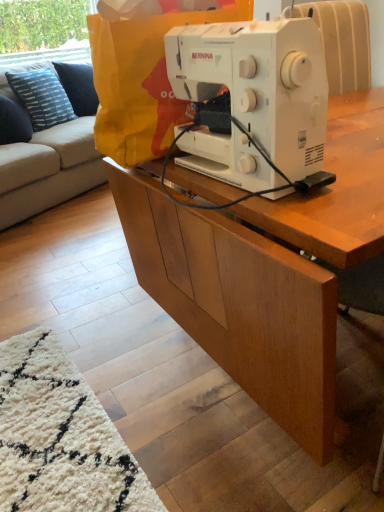
Where is `yellow paper bag at center`? The image size is (384, 512). yellow paper bag at center is located at coordinates (142, 80).

The height and width of the screenshot is (512, 384). Describe the element at coordinates (253, 103) in the screenshot. I see `white plastic sewing machine at center` at that location.

This screenshot has width=384, height=512. I want to click on light gray fabric couch at upper left, so click(x=47, y=143).

The width and height of the screenshot is (384, 512). In order to click on sewing machine that is in front of the yellow paper bag at center in this screenshot , I will do [x=253, y=103].

Considering the sizes of objects white plastic sewing machine at center and yellow paper bag at center in the image provided, who is taller, white plastic sewing machine at center or yellow paper bag at center?

With more height is yellow paper bag at center.

Does white plastic sewing machine at center have a greater width compared to yellow paper bag at center?

Incorrect, the width of white plastic sewing machine at center does not surpass that of yellow paper bag at center.

Does point (260, 189) come closer to viewer compared to point (231, 4)?

Yes, it is in front of point (231, 4).

Which object is wider, blue striped fabric pillow at upper left or wooden cabinet at center?

wooden cabinet at center is wider.

Can you confirm if blue striped fabric pillow at upper left is positioned to the right of wooden cabinet at center?

Incorrect, blue striped fabric pillow at upper left is not on the right side of wooden cabinet at center.

From a real-world perspective, is blue striped fabric pillow at upper left positioned under wooden cabinet at center based on gravity?

No, from a real-world perspective, blue striped fabric pillow at upper left is not under wooden cabinet at center.

Between blue striped fabric pillow at upper left and wooden cabinet at center, which one is positioned in front?

wooden cabinet at center is in front.

Consider the image. Who is more distant, blue striped fabric pillow at upper left or white plastic sewing machine at center?

blue striped fabric pillow at upper left is further away from the camera.

Could you measure the distance between blue striped fabric pillow at upper left and white plastic sewing machine at center?

blue striped fabric pillow at upper left and white plastic sewing machine at center are 2.43 meters apart.

Is blue striped fabric pillow at upper left bigger or smaller than white plastic sewing machine at center?

Clearly, blue striped fabric pillow at upper left is larger in size than white plastic sewing machine at center.

From a real-world perspective, who is located lower, blue striped fabric pillow at upper left or white plastic sewing machine at center?

blue striped fabric pillow at upper left, from a real-world perspective.

Is white plastic sewing machine at center oriented towards wooden cabinet at center?

No, white plastic sewing machine at center is not oriented towards wooden cabinet at center.

Are white plastic sewing machine at center and wooden cabinet at center far apart?

white plastic sewing machine at center is actually quite close to wooden cabinet at center.

Does white plastic sewing machine at center have a lesser height compared to wooden cabinet at center?

No.

Considering their positions, is wooden cabinet at center located in front of or behind white plastic sewing machine at center?

In the image, wooden cabinet at center appears behind white plastic sewing machine at center.

Is wooden cabinet at center next to white plastic sewing machine at center?

No, wooden cabinet at center is not in contact with white plastic sewing machine at center.

Which of these two, wooden cabinet at center or white plastic sewing machine at center, is bigger?

wooden cabinet at center is bigger.

From a real-world perspective, who is located higher, light gray fabric couch at upper left or wooden cabinet at center?

light gray fabric couch at upper left, from a real-world perspective.

Looking at the image, does light gray fabric couch at upper left seem bigger or smaller compared to wooden cabinet at center?

Considering their sizes, light gray fabric couch at upper left takes up more space than wooden cabinet at center.

Does point (41, 186) appear closer or farther from the camera than point (309, 344)?

Point (41, 186) is farther from the camera than point (309, 344).

Is point (115, 151) closer to viewer compared to point (89, 133)?

That is True.

Between yellow paper bag at center and light gray fabric couch at upper left, which one is positioned behind?

Positioned behind is light gray fabric couch at upper left.

Could you tell me if yellow paper bag at center is turned towards light gray fabric couch at upper left?

No, yellow paper bag at center is not oriented towards light gray fabric couch at upper left.

How different are the orientations of yellow paper bag at center and light gray fabric couch at upper left in degrees?

58.2 degrees separate the facing orientations of yellow paper bag at center and light gray fabric couch at upper left.

Where is `sewing machine beneath the yellow paper bag at center (from a real-world perspective)`? Image resolution: width=384 pixels, height=512 pixels. sewing machine beneath the yellow paper bag at center (from a real-world perspective) is located at coordinates (253, 103).

Identify the location of cabinetry located on the right of blue striped fabric pillow at upper left. This screenshot has width=384, height=512. (240, 304).

Estimate the real-world distances between objects in this image. Which object is further from white plastic sewing machine at center, wooden cabinet at center or yellow paper bag at center?

Among the two, wooden cabinet at center is located further to white plastic sewing machine at center.

Looking at the image, which one is located closer to light gray fabric couch at upper left, yellow paper bag at center or wooden cabinet at center?

Based on the image, wooden cabinet at center appears to be nearer to light gray fabric couch at upper left.

Which object lies further to the anchor point light gray fabric couch at upper left, blue striped fabric pillow at upper left or white plastic sewing machine at center?

Based on the image, white plastic sewing machine at center appears to be further to light gray fabric couch at upper left.

When comparing their distances from white plastic sewing machine at center, does light gray fabric couch at upper left or yellow paper bag at center seem closer?

yellow paper bag at center is closer to white plastic sewing machine at center.

Estimate the real-world distances between objects in this image. Which object is closer to yellow paper bag at center, light gray fabric couch at upper left or blue striped fabric pillow at upper left?

Based on the image, light gray fabric couch at upper left appears to be nearer to yellow paper bag at center.

When comparing their distances from yellow paper bag at center, does white plastic sewing machine at center or light gray fabric couch at upper left seem closer?

white plastic sewing machine at center is positioned closer to the anchor yellow paper bag at center.

From the image, which object appears to be nearer to yellow paper bag at center, blue striped fabric pillow at upper left or wooden cabinet at center?

Based on the image, wooden cabinet at center appears to be nearer to yellow paper bag at center.

Based on their spatial positions, is blue striped fabric pillow at upper left or light gray fabric couch at upper left closer to white plastic sewing machine at center?

light gray fabric couch at upper left.

The width and height of the screenshot is (384, 512). I want to click on studio couch between yellow paper bag at center and blue striped fabric pillow at upper left in the front-back direction, so click(47, 143).

I want to click on cabinetry positioned between white plastic sewing machine at center and light gray fabric couch at upper left from near to far, so click(x=240, y=304).

The width and height of the screenshot is (384, 512). I want to click on sewing machine that lies between yellow paper bag at center and wooden cabinet at center from top to bottom, so click(x=253, y=103).

In order to click on studio couch positioned between white plastic sewing machine at center and blue striped fabric pillow at upper left from near to far in this screenshot , I will do `click(47, 143)`.